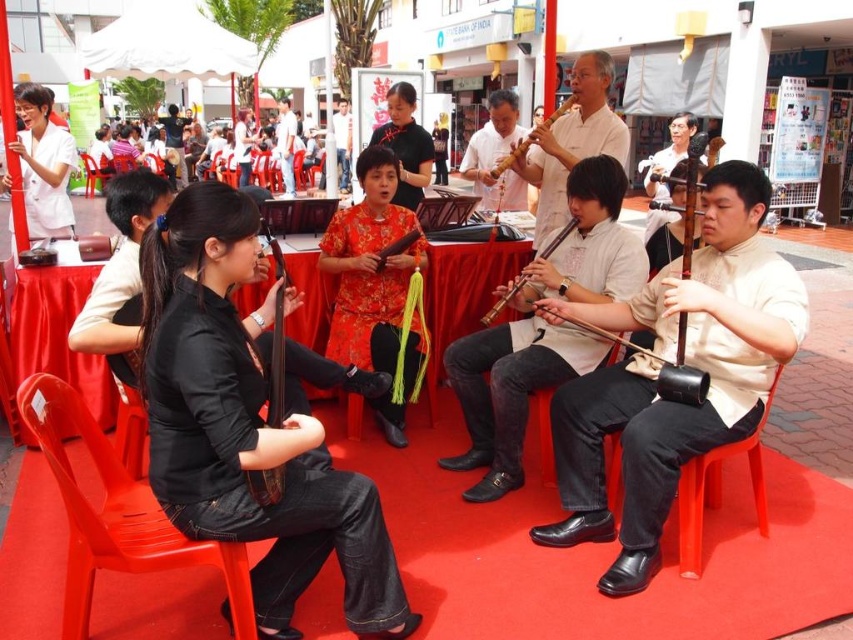
You are a photographer positioned at the origin point of the image, which is the bottom left corner. You want to capture a closeup shot of the red satin dress at center. According to the coordinates provided, what are the exact coordinates where you should aim your camera?

The exact coordinates to aim your camera are at point [370,268].

You are standing in the crowd watching the performance. There is a point marked at coordinates [286,145] on the image. Which object is this point located on?

The point at [286,145] is located on the matte black shirt at center.